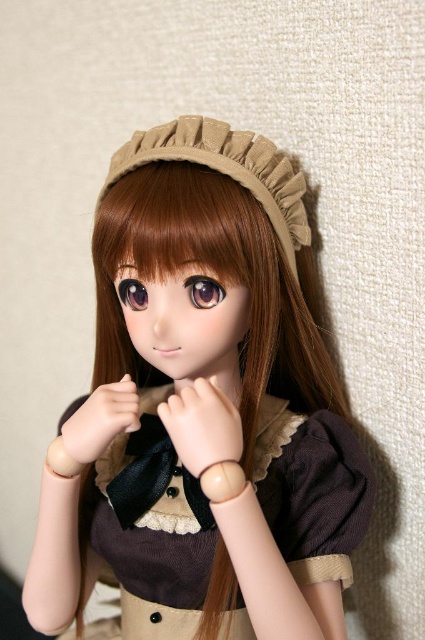
Can you confirm if matte brown dress at center is positioned to the left of matte brown bracelet at center?

In fact, matte brown dress at center is to the right of matte brown bracelet at center.

Is matte brown dress at center closer to the viewer compared to matte brown bracelet at center?

Yes, it is in front of matte brown bracelet at center.

In order to click on matte brown dress at center in this screenshot , I will do `click(223, 394)`.

Identify the location of purple glossy eye at center. Image resolution: width=425 pixels, height=640 pixels. (204, 291).

This screenshot has height=640, width=425. Describe the element at coordinates (204, 291) in the screenshot. I see `purple glossy eye at center` at that location.

The width and height of the screenshot is (425, 640). Describe the element at coordinates (204, 291) in the screenshot. I see `purple glossy eye at center` at that location.

The image size is (425, 640). In order to click on purple glossy eye at center in this screenshot , I will do `click(204, 291)`.

Between matte brown bracelet at center and glossy purple eye at center, which one appears on the right side from the viewer's perspective?

glossy purple eye at center is more to the right.

Is matte brown bracelet at center bigger than glossy purple eye at center?

Yes, matte brown bracelet at center is bigger than glossy purple eye at center.

Identify the location of matte brown bracelet at center. (101, 420).